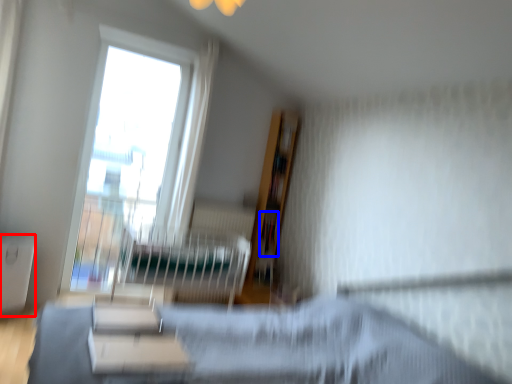
Question: Which object is further to the camera taking this photo, table (highlighted by a red box) or book (highlighted by a blue box)?

Choices:
 (A) table
 (B) book

Answer: (B)